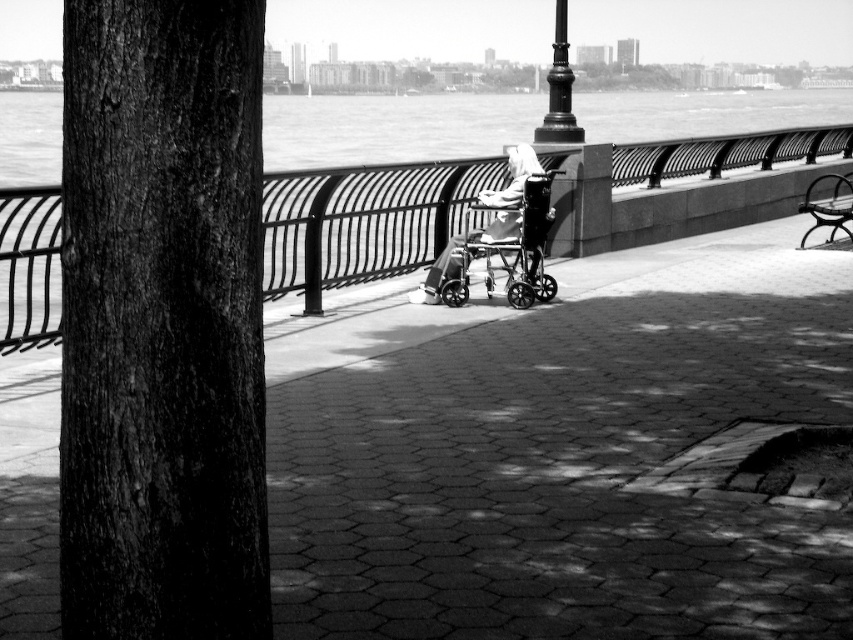
Question: Is brick pavement at center behind smooth metal bench at right?

Choices:
 (A) yes
 (B) no

Answer: (B)

Question: Which object appears farthest from the camera in this image?

Choices:
 (A) smooth metal bench at right
 (B) black polished metal pole at center
 (C) smooth metal railing at center
 (D) metallic silver walker at center

Answer: (A)

Question: Which of these objects is positioned farthest from the metallic silver walker at center?

Choices:
 (A) smooth metal bench at right
 (B) black polished metal pole at center
 (C) brick pavement at center
 (D) dark textured bark at left

Answer: (D)

Question: Can you confirm if brick pavement at center is wider than metallic silver walker at center?

Choices:
 (A) yes
 (B) no

Answer: (A)

Question: Which point appears farthest from the camera in this image?

Choices:
 (A) (418, 196)
 (B) (804, 195)
 (C) (553, 109)
 (D) (527, 252)

Answer: (B)

Question: Is brick pavement at center positioned behind metallic silver walker at center?

Choices:
 (A) no
 (B) yes

Answer: (A)